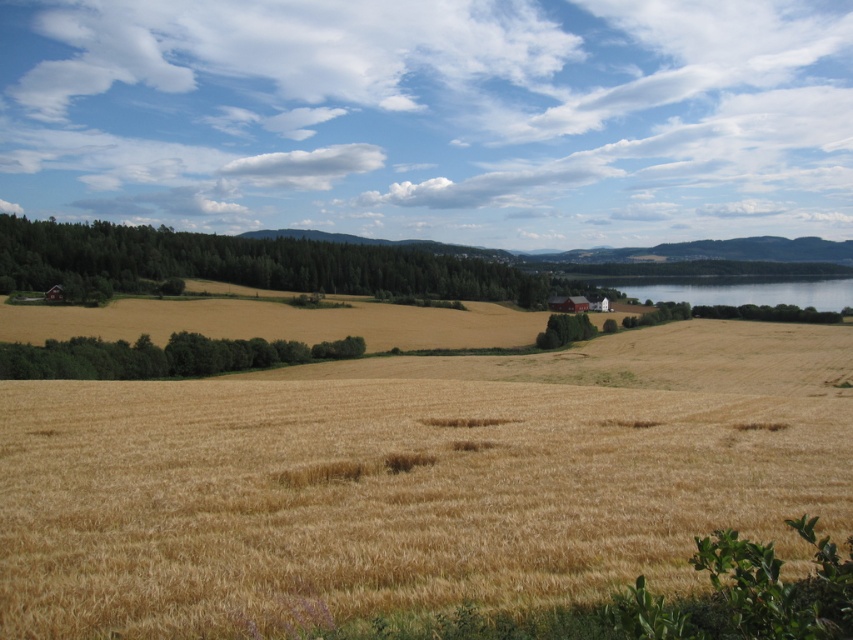
Which is above, green leafy trees at left or transparent blue water at right?

green leafy trees at left

In the scene shown: Does green leafy trees at left have a greater height compared to transparent blue water at right?

Correct, green leafy trees at left is much taller as transparent blue water at right.

Which is in front, point (54, 253) or point (810, 304)?

Positioned in front is point (54, 253).

Locate an element on the screen. The width and height of the screenshot is (853, 640). green leafy trees at left is located at coordinates (250, 264).

Is golden wheat field at center positioned before transparent blue water at right?

That is True.

Between point (798, 435) and point (653, 296), which one is positioned in front?

Positioned in front is point (798, 435).

The width and height of the screenshot is (853, 640). In order to click on golden wheat field at center in this screenshot , I will do `click(384, 496)`.

Is green leafy trees at center to the left of transparent blue water at right from the viewer's perspective?

Yes, green leafy trees at center is to the left of transparent blue water at right.

Is green leafy trees at center closer to camera compared to transparent blue water at right?

Yes.

Who is more forward, (225, 353) or (842, 298)?

Positioned in front is point (225, 353).

Where is `green leafy trees at center`? green leafy trees at center is located at coordinates (160, 356).